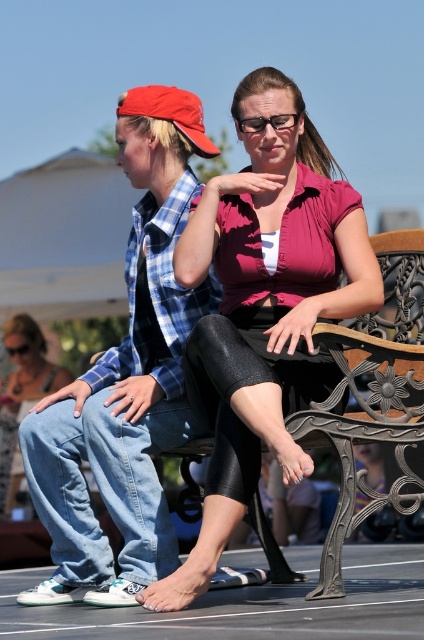
Question: Does matte pink blouse at center appear over denim jeans at left?

Choices:
 (A) no
 (B) yes

Answer: (B)

Question: Does matte pink blouse at center come in front of denim jeans at left?

Choices:
 (A) no
 (B) yes

Answer: (B)

Question: Which object appears farthest from the camera in this image?

Choices:
 (A) denim pants at left
 (B) denim jeans at left
 (C) matte pink blouse at center

Answer: (A)

Question: Which of the following is the closest to the observer?

Choices:
 (A) matte pink blouse at center
 (B) denim pants at left
 (C) denim jeans at left

Answer: (A)

Question: Among these objects, which one is farthest from the camera?

Choices:
 (A) denim pants at left
 (B) matte pink blouse at center
 (C) denim jeans at left

Answer: (A)

Question: Can you confirm if denim jeans at left is positioned to the left of denim pants at left?

Choices:
 (A) yes
 (B) no

Answer: (B)